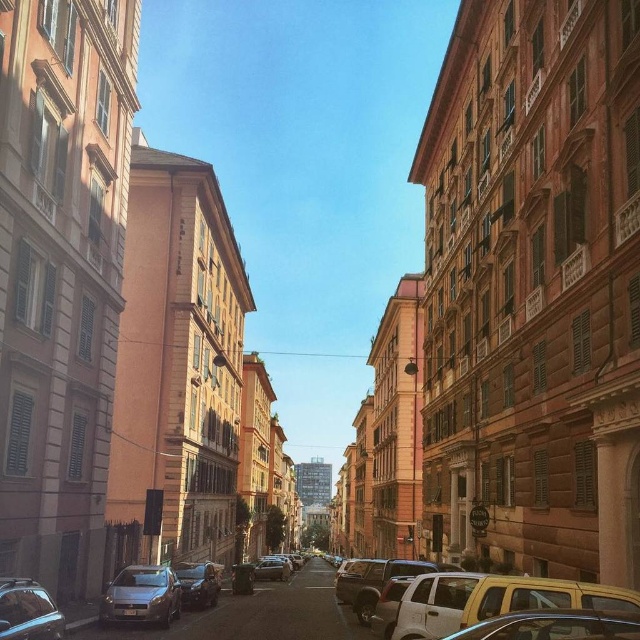
From the picture: You are standing at the point with coordinates point (156, 573) and want to walk towards the point with coordinates point (483, 577). Which direction should you move relative to the street layout?

You should move forward along the street towards point (483, 577) because it is in front of point (156, 573) according to the spatial arrangement.

You are a delivery person trying to park a 1.5 meter tall delivery van in the parking spot between the shiny black car at lower left and the matte black car at lower left. Can your van fit vertically between them?

The shiny black car at lower left is not as tall as matte black car at lower left. The height of the delivery van is 1.5 meters, but the available vertical space between the two cars depends on the height difference between them. Since the shiny black car is shorter, the vertical clearance might be sufficient if the difference between the two cars is at least 1.5 meters. However, without knowing the exact heights, it is uncertain if the van will fit.